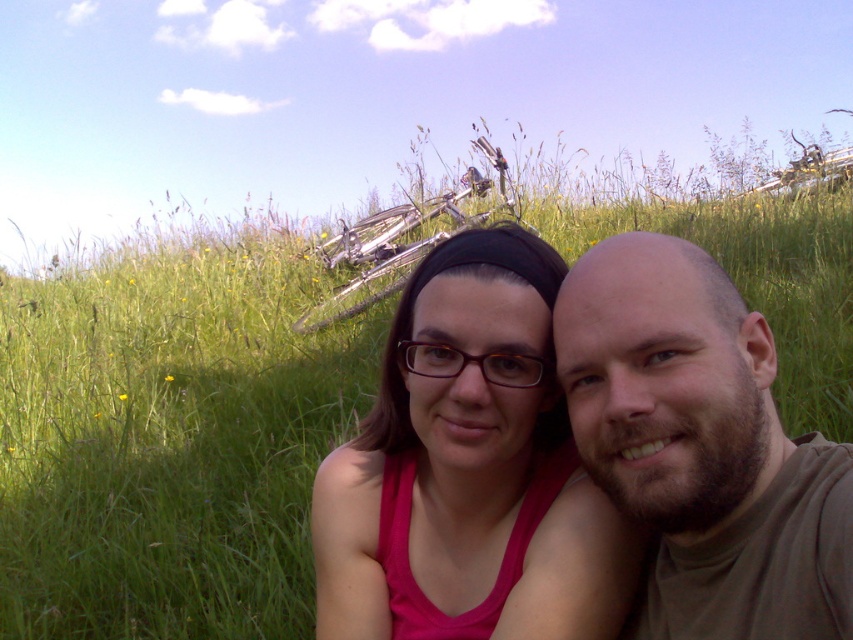
Is pink fabric tank top at center closer to camera compared to brown matte shirt at center?

That is False.

Is point (532, 560) closer to camera compared to point (614, 500)?

That is False.

Where is `pink fabric tank top at center`? The width and height of the screenshot is (853, 640). pink fabric tank top at center is located at coordinates (469, 470).